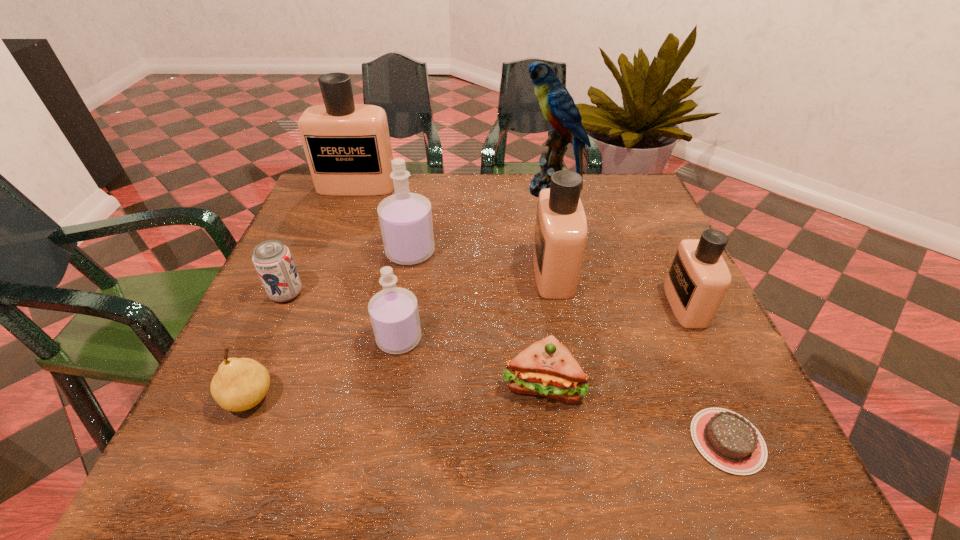
Locate an element on the screen. The width and height of the screenshot is (960, 540). the closest perfume to the nearer purple perfume is located at coordinates (405, 218).

Find the location of a particular element. beige perfume that is the third closest one to the pear is located at coordinates (698, 279).

The width and height of the screenshot is (960, 540). What are the coordinates of `beige perfume that stands as the closest to the second beige perfume from left to right` in the screenshot? It's located at (698, 279).

I want to click on vacant space that satisfies the following two spatial constraints: 1. on the front label of the second biggest beige perfume; 2. on the front side of the nearer purple perfume, so click(565, 339).

Locate an element on the screen. The width and height of the screenshot is (960, 540). free space that satisfies the following two spatial constraints: 1. on the front label of the farther purple perfume; 2. on the left side of the leftmost perfume is located at coordinates (331, 252).

I want to click on vacant space that satisfies the following two spatial constraints: 1. on the front label of the smaller purple perfume; 2. on the right side of the leftmost beige perfume, so click(x=299, y=339).